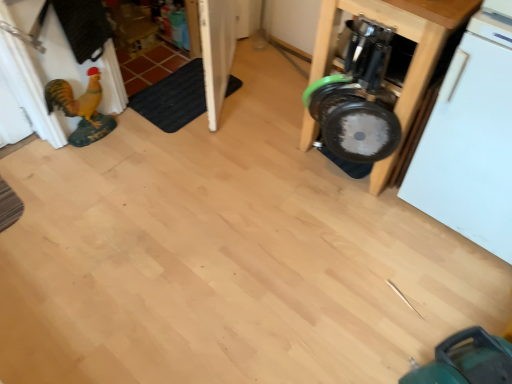
Locate an element on the screen. Image resolution: width=512 pixels, height=384 pixels. vacant area that lies between metallic silver dumbbell at right and black rubber mat at lower left is located at coordinates (260, 124).